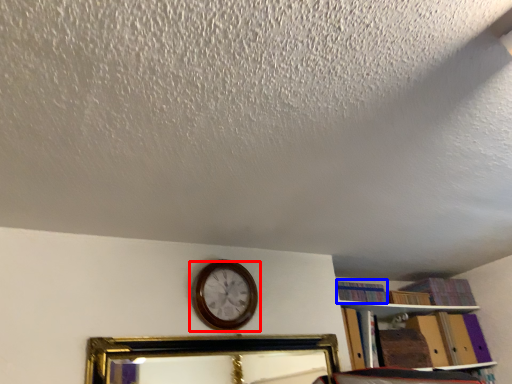
Question: Which of the following is the closest to the observer, wall clock (highlighted by a red box) or book (highlighted by a blue box)?

Choices:
 (A) wall clock
 (B) book

Answer: (A)